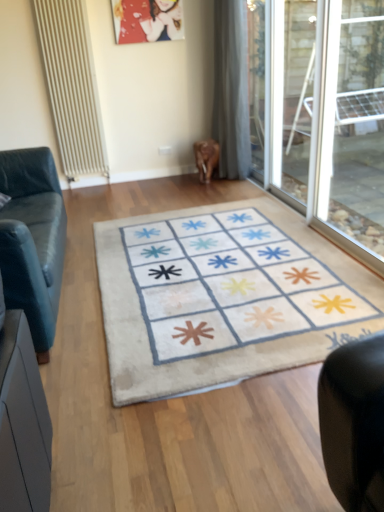
Question: Considering the relative sizes of gray fabric curtain at center and beige fabric doormat at center in the image provided, is gray fabric curtain at center smaller than beige fabric doormat at center?

Choices:
 (A) yes
 (B) no

Answer: (B)

Question: Is gray fabric curtain at center far away from beige fabric doormat at center?

Choices:
 (A) no
 (B) yes

Answer: (B)

Question: From the image's perspective, is gray fabric curtain at center located above beige fabric doormat at center?

Choices:
 (A) yes
 (B) no

Answer: (A)

Question: Is gray fabric curtain at center in front of beige fabric doormat at center?

Choices:
 (A) yes
 (B) no

Answer: (B)

Question: Is gray fabric curtain at center at the left side of beige fabric doormat at center?

Choices:
 (A) yes
 (B) no

Answer: (B)

Question: From a real-world perspective, is gray fabric curtain at center below beige fabric doormat at center?

Choices:
 (A) no
 (B) yes

Answer: (A)

Question: Does beige fabric doormat at center have a greater width compared to transparent glass window at right?

Choices:
 (A) yes
 (B) no

Answer: (A)

Question: Is beige fabric doormat at center to the left of transparent glass window at right from the viewer's perspective?

Choices:
 (A) yes
 (B) no

Answer: (A)

Question: Is beige fabric doormat at center outside of transparent glass window at right?

Choices:
 (A) yes
 (B) no

Answer: (A)

Question: Is beige fabric doormat at center beside transparent glass window at right?

Choices:
 (A) yes
 (B) no

Answer: (B)

Question: From the image's perspective, is beige fabric doormat at center under transparent glass window at right?

Choices:
 (A) yes
 (B) no

Answer: (A)

Question: Is beige fabric doormat at center not near transparent glass window at right?

Choices:
 (A) yes
 (B) no

Answer: (A)

Question: Is beige textured radiator at left completely or partially inside matte plastic picture frame at upper center?

Choices:
 (A) yes
 (B) no

Answer: (B)